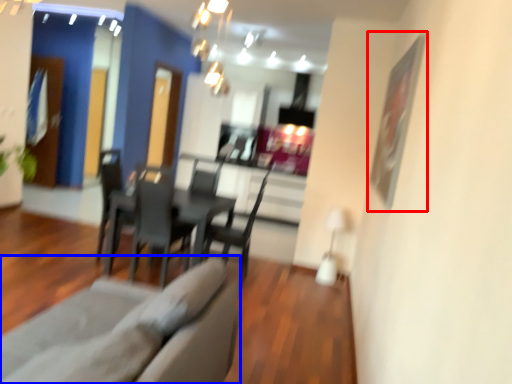
Question: Which object is closer to the camera taking this photo, picture frame (highlighted by a red box) or couch (highlighted by a blue box)?

Choices:
 (A) picture frame
 (B) couch

Answer: (B)